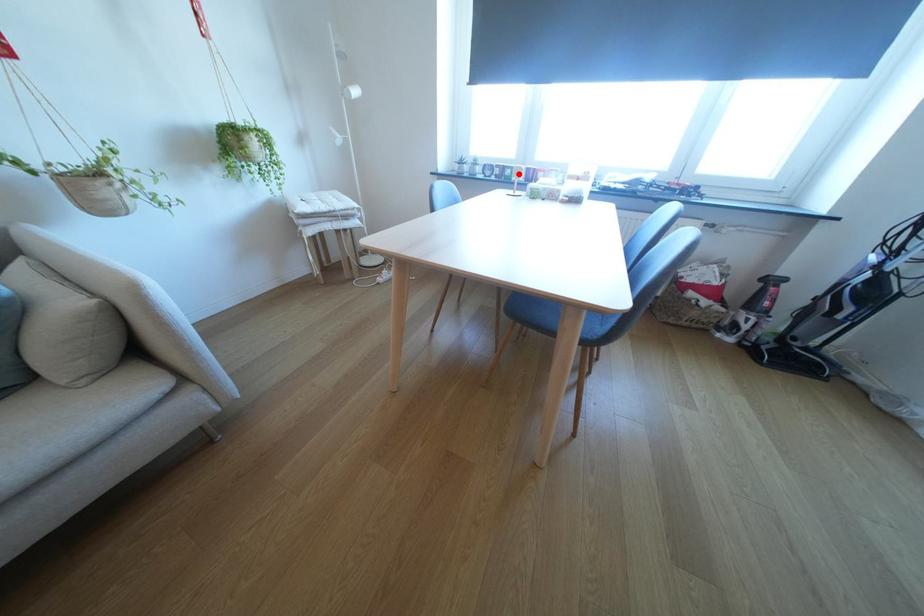
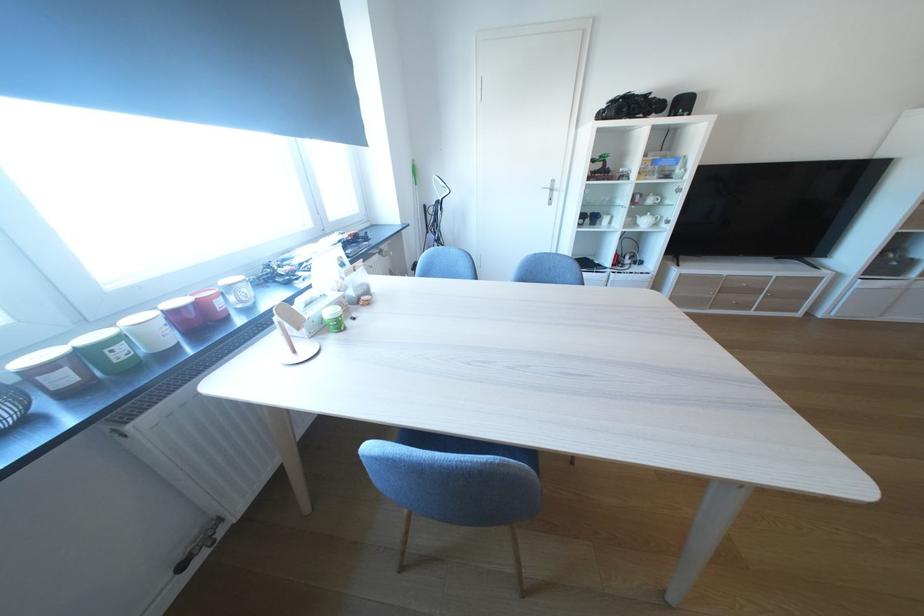
The point at the highlighted location is marked in the first image. Where is the corresponding point in the second image?

(129, 354)